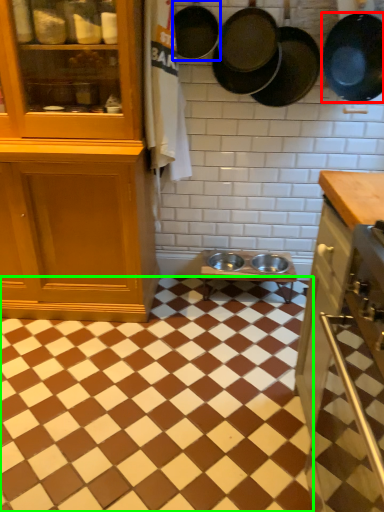
Question: Considering the real-world distances, which object is farthest from frying pan (highlighted by a red box)? frying pan (highlighted by a blue box) or square (highlighted by a green box)?

Choices:
 (A) frying pan
 (B) square

Answer: (B)